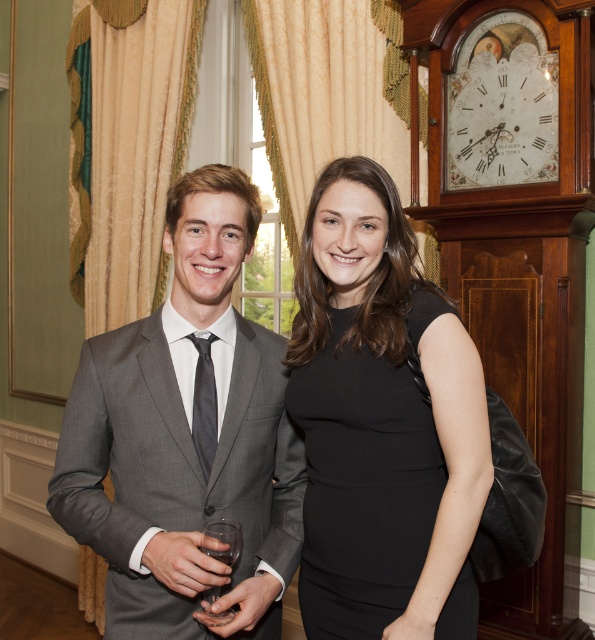
Question: Which object is the farthest from the white paper clock face at upper right?

Choices:
 (A) black matte dress at center
 (B) transparent glass at center
 (C) black satin tie at center

Answer: (B)

Question: Is black matte dress at center bigger than black satin tie at center?

Choices:
 (A) no
 (B) yes

Answer: (B)

Question: Is black matte dress at center above white paper clock face at upper right?

Choices:
 (A) yes
 (B) no

Answer: (B)

Question: Can you confirm if black matte dress at center is positioned above black satin tie at center?

Choices:
 (A) no
 (B) yes

Answer: (A)

Question: Which point is closer to the camera?

Choices:
 (A) (461, 620)
 (B) (199, 342)
 (C) (509, 72)

Answer: (A)

Question: Which of the following is the closest to the observer?

Choices:
 (A) gray suit at center
 (B) transparent glass at center
 (C) black matte dress at center

Answer: (B)